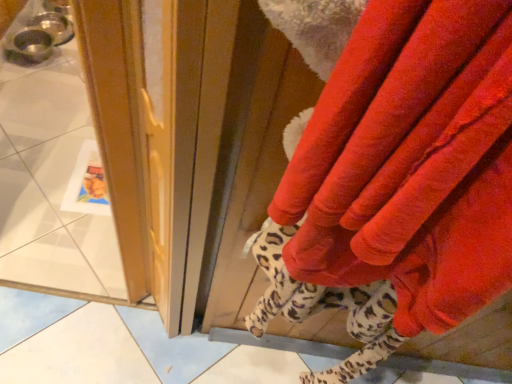
Identify the location of velvet red towel at lower right. The height and width of the screenshot is (384, 512). (411, 162).

This screenshot has height=384, width=512. What do you see at coordinates (411, 162) in the screenshot?
I see `velvet red towel at lower right` at bounding box center [411, 162].

This screenshot has width=512, height=384. I want to click on velvet red towel at lower right, so click(x=411, y=162).